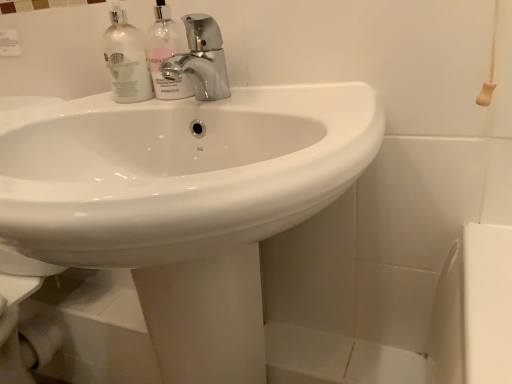
Locate an element on the screen. The height and width of the screenshot is (384, 512). unoccupied region to the right of chrome metallic faucet at center is located at coordinates (297, 92).